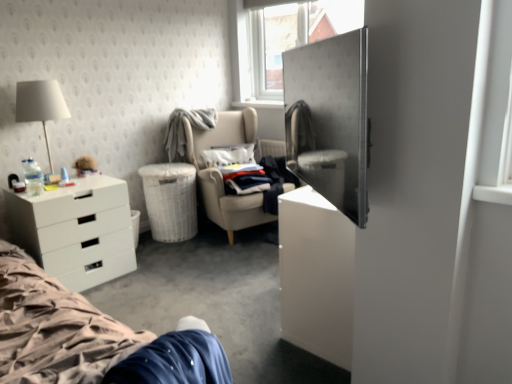
Question: Does point (232, 147) appear closer or farther from the camera than point (55, 92)?

Choices:
 (A) farther
 (B) closer

Answer: (A)

Question: Relative to white matte lampshade at upper left, is white fabric pillow at center in front or behind?

Choices:
 (A) behind
 (B) front

Answer: (A)

Question: Which is nearer to the gray fabric clothing at center?

Choices:
 (A) clear plastic bottle at left
 (B) white woven trash bin/can at lower left
 (C) beige fabric chair at center
 (D) white matte lampshade at upper left
 (E) white matte drawer at lower left

Answer: (C)

Question: Estimate the real-world distances between objects in this image. Which object is farther from the metallic silver armoire at right?

Choices:
 (A) gray fabric clothing at center
 (B) white fabric pillow at center
 (C) white woven trash bin/can at lower left
 (D) beige fabric chair at center
 (E) white matte drawer at lower left

Answer: (A)